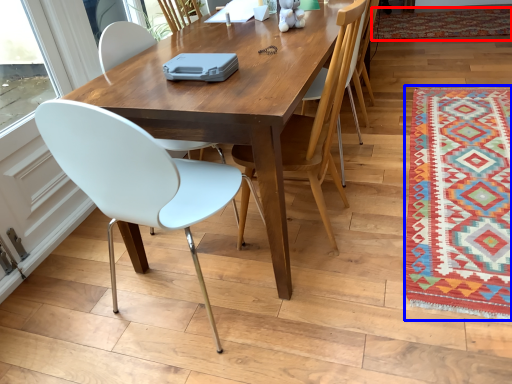
Question: Which point is closer to the camera, mat (highlighted by a red box) or mat (highlighted by a blue box)?

Choices:
 (A) mat
 (B) mat

Answer: (B)